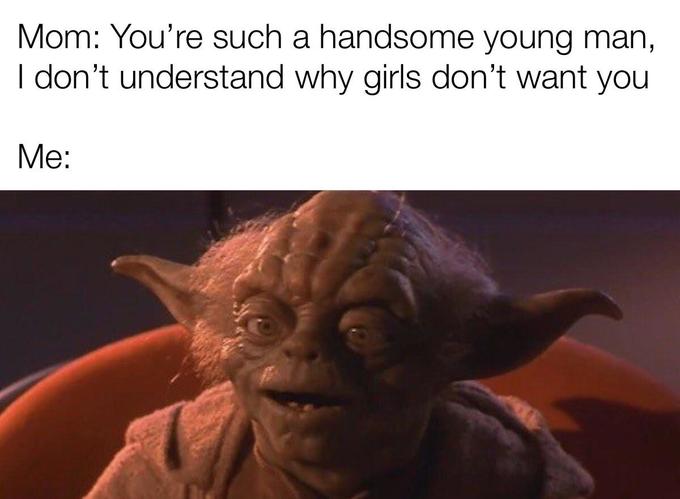
I want to click on picture, so click(x=166, y=215).